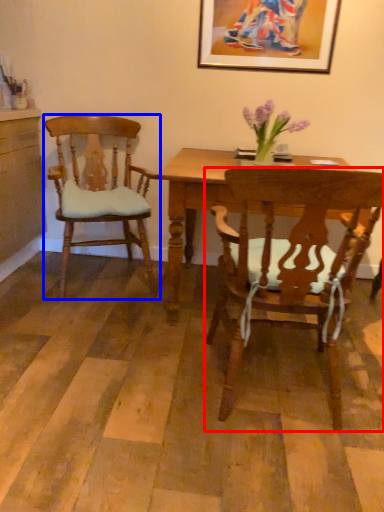
Question: Which of the following is the closest to the observer, chair (highlighted by a red box) or chair (highlighted by a blue box)?

Choices:
 (A) chair
 (B) chair

Answer: (A)